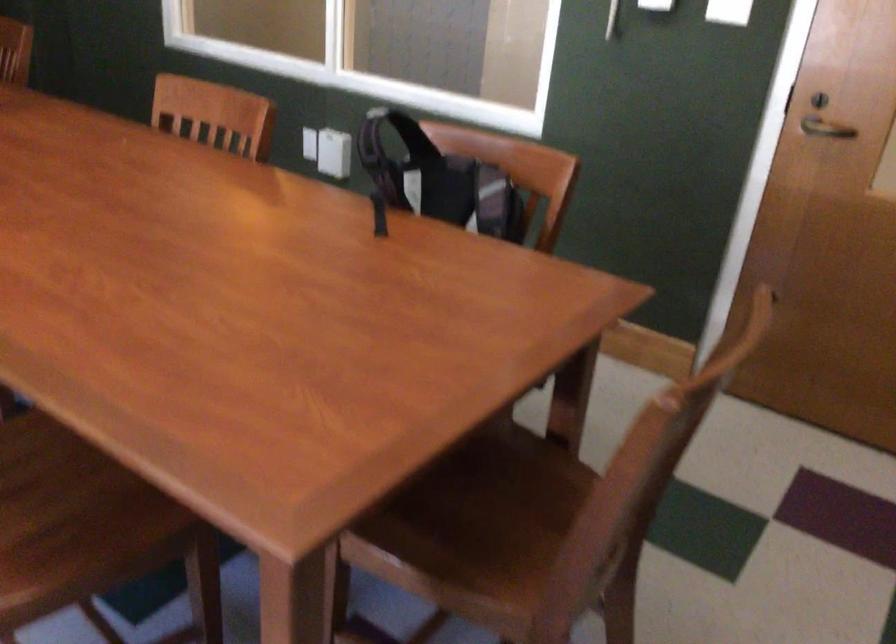
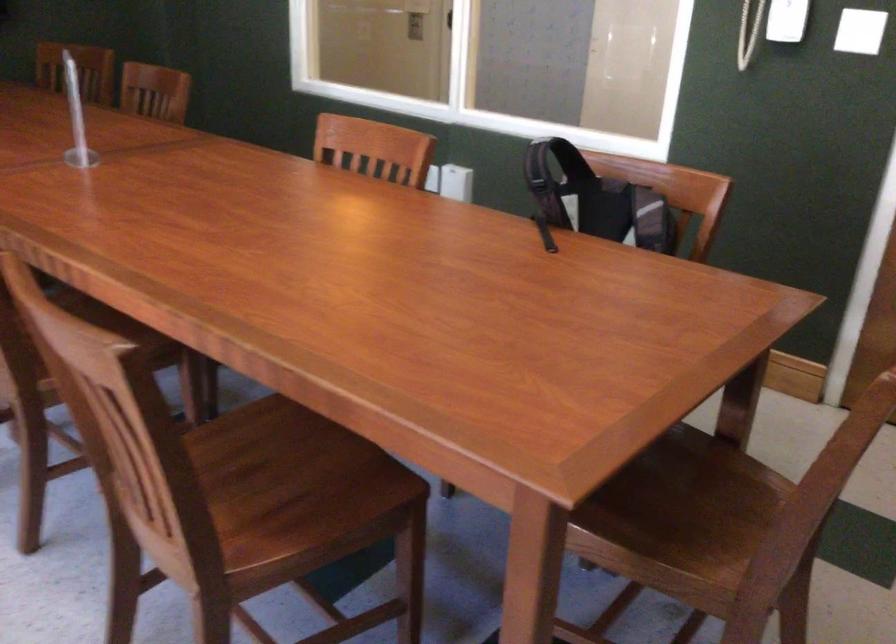
Question: The camera is either moving clockwise (left) or counter-clockwise (right) around the object. The first image is from the beginning of the video and the second image is from the end. Is the camera moving left or right when shooting the video?

Choices:
 (A) Left
 (B) Right

Answer: (B)